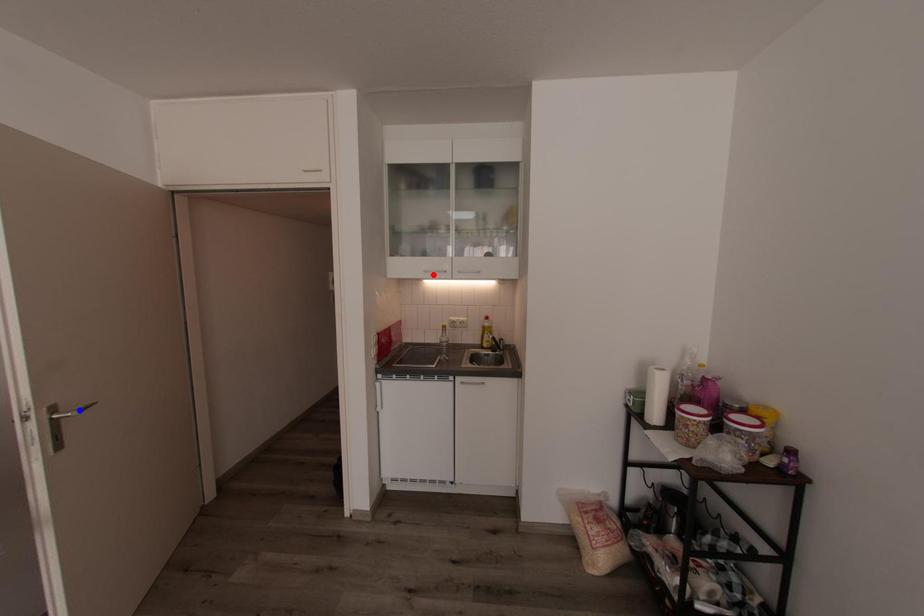
Question: Which of the two points in the image is closer to the camera?

Choices:
 (A) Blue point is closer.
 (B) Red point is closer.

Answer: (A)